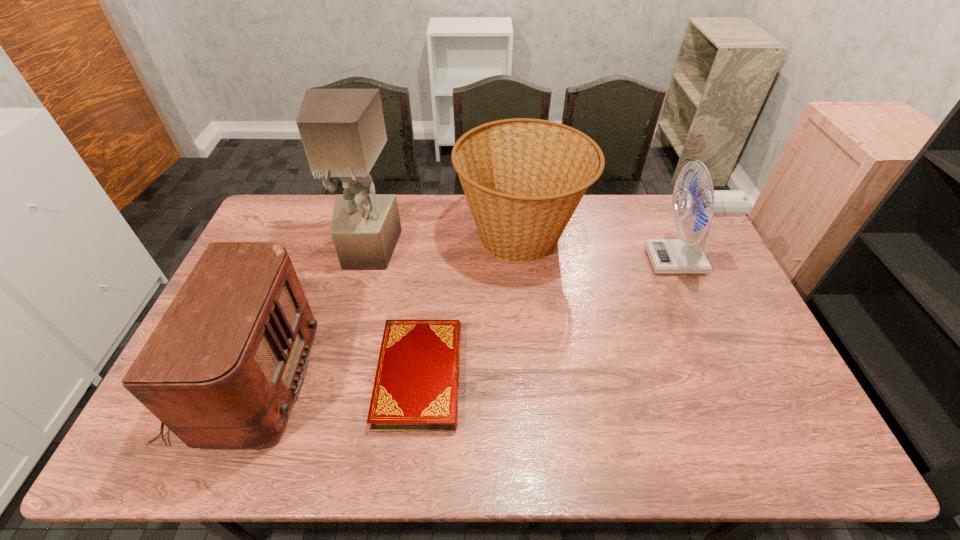
Where is `the tallest object`? the tallest object is located at coordinates (343, 132).

Identify the location of the rightmost object. The height and width of the screenshot is (540, 960). (668, 256).

At what (x,y) coordinates should I click in order to perform the action: click on basket. Please return your answer as a coordinate pair (x, y). Looking at the image, I should click on (523, 178).

I want to click on radio receiver, so click(x=222, y=369).

Find the location of a particular element. The width and height of the screenshot is (960, 540). the shortest object is located at coordinates (416, 388).

Identify the location of free location located 0.110m on the front-facing side of the sculpture. (356, 298).

The height and width of the screenshot is (540, 960). Find the location of `free space located on the front-facing side of the rightmost object`. free space located on the front-facing side of the rightmost object is located at coordinates (586, 261).

Image resolution: width=960 pixels, height=540 pixels. In order to click on blank space located on the front-facing side of the rightmost object in this screenshot , I will do `click(538, 261)`.

I want to click on blank space located 0.200m on the front-facing side of the rightmost object, so click(x=588, y=261).

Where is `free space located 0.310m on the front of the basket`? The width and height of the screenshot is (960, 540). free space located 0.310m on the front of the basket is located at coordinates click(534, 368).